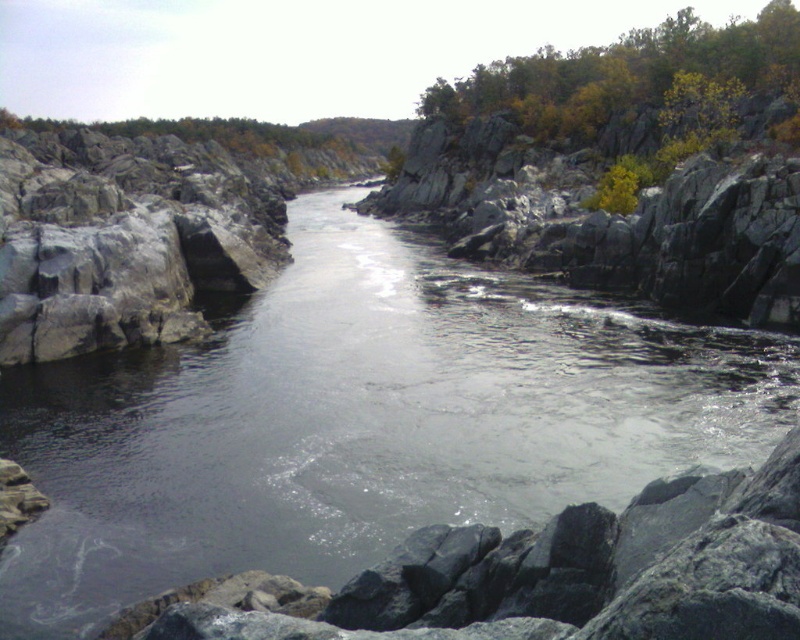
Does gray/rocky river at center have a lesser height compared to yellow-green foliage at upper right?

Correct, gray/rocky river at center is not as tall as yellow-green foliage at upper right.

Which is above, gray/rocky river at center or yellow-green foliage at upper right?

Positioned higher is yellow-green foliage at upper right.

This screenshot has width=800, height=640. I want to click on gray/rocky river at center, so (x=356, y=426).